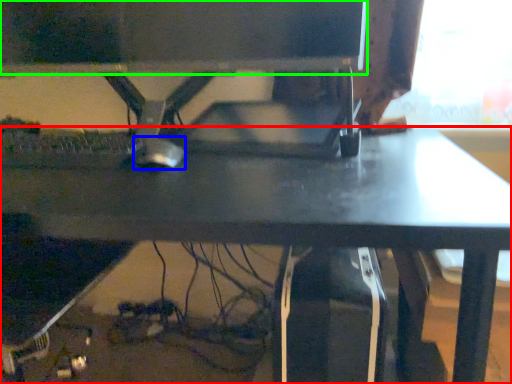
Question: Estimate the real-world distances between objects in this image. Which object is farther from desk (highlighted by a red box), mouse (highlighted by a blue box) or computer monitor (highlighted by a green box)?

Choices:
 (A) mouse
 (B) computer monitor

Answer: (B)